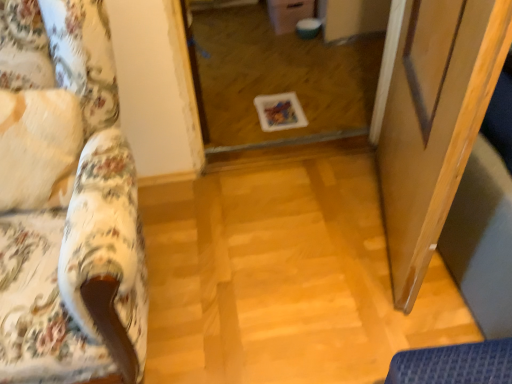
Question: From the image's perspective, is transparent glass screen door at right located above or below floral fabric couch at left?

Choices:
 (A) below
 (B) above

Answer: (B)

Question: Considering the positions of transparent glass screen door at right and floral fabric couch at left in the image, is transparent glass screen door at right bigger or smaller than floral fabric couch at left?

Choices:
 (A) small
 (B) big

Answer: (A)

Question: Considering the real-world distances, which object is farthest from the transparent glass door at center?

Choices:
 (A) floral fabric couch at left
 (B) transparent glass screen door at right

Answer: (A)

Question: Which of these objects is positioned farthest from the transparent glass screen door at right?

Choices:
 (A) floral fabric couch at left
 (B) transparent glass door at center

Answer: (B)